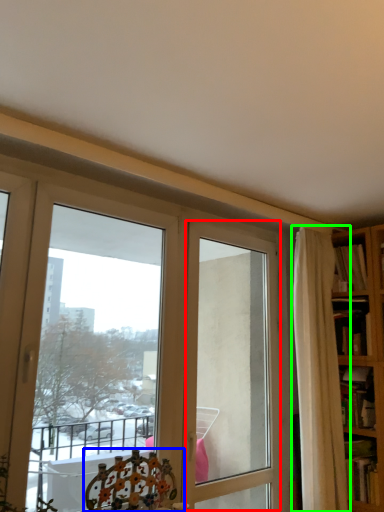
Question: Estimate the real-world distances between objects in this image. Which object is closer to screen door (highlighted by a red box), chair (highlighted by a blue box) or curtain (highlighted by a green box)?

Choices:
 (A) chair
 (B) curtain

Answer: (B)